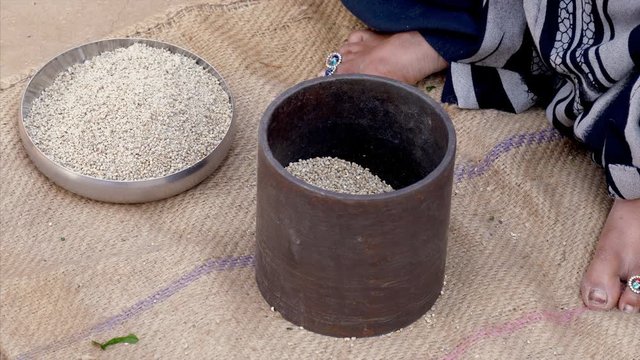
Where is `bowl`? This screenshot has height=360, width=640. bowl is located at coordinates (x=180, y=174).